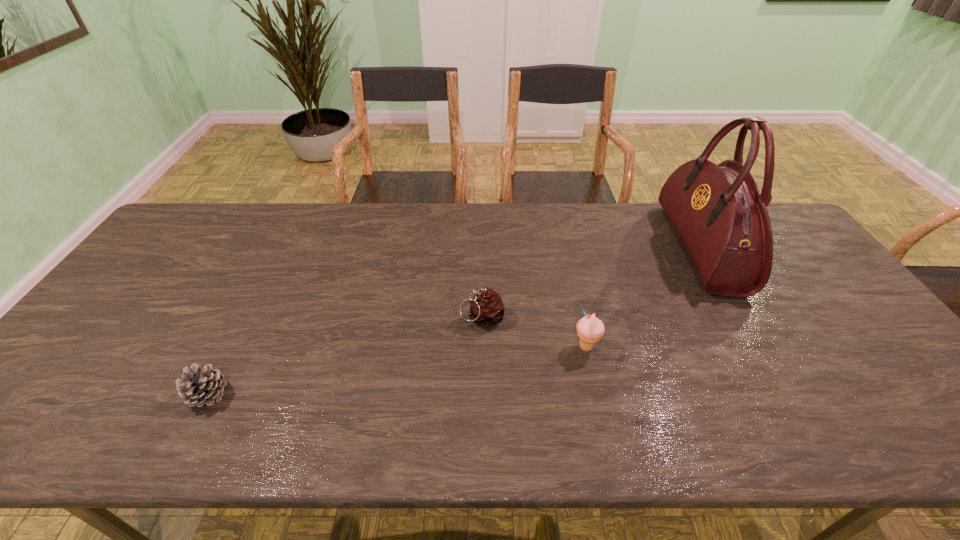
Where is `the rightmost object`? This screenshot has height=540, width=960. the rightmost object is located at coordinates (718, 212).

In order to click on handbag in this screenshot , I will do `click(718, 212)`.

This screenshot has height=540, width=960. I want to click on the second object from right to left, so click(590, 329).

Identify the location of icecream. This screenshot has height=540, width=960. (590, 329).

The width and height of the screenshot is (960, 540). In order to click on the farther pinecone in this screenshot , I will do `click(487, 309)`.

This screenshot has height=540, width=960. Find the location of `the third nearest object`. the third nearest object is located at coordinates (487, 309).

You are a GUI agent. You are given a task and a screenshot of the screen. Output one action in this format:
    pyautogui.click(x=<x>, y=<y>)
    Task: Click on the nearer pinecone
    
    Given the screenshot: What is the action you would take?
    pyautogui.click(x=199, y=386)

Find the location of a particular element. This screenshot has width=960, height=540. the nearest object is located at coordinates (199, 386).

This screenshot has height=540, width=960. Find the location of `vacant region located 0.190m on the front-facing side of the tallest object`. vacant region located 0.190m on the front-facing side of the tallest object is located at coordinates (613, 248).

This screenshot has height=540, width=960. I want to click on vacant region located on the front-facing side of the tallest object, so click(655, 248).